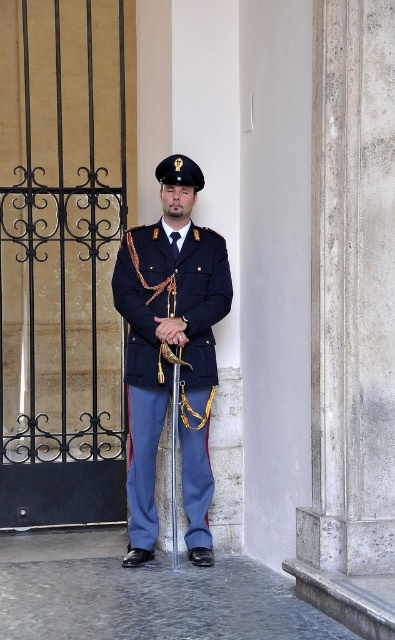
You are a tailor measuring a mannequin wearing the navy blue fabric uniform at center and the metallic gold pole at center. Which object has a greater width?

The navy blue fabric uniform at center has a greater width than the metallic gold pole at center.

You are a photographer planning to take a portrait of the navy blue fabric uniform at center. You want to ensure the black wrought iron gate at left is visible in the background but not too prominent. Given their sizes, can you position yourself so that the gate is partially visible without overwhelming the uniform?

The black wrought iron gate at left is wider than the navy blue fabric uniform at center. To include the gate in the background without it being too prominent, position yourself so that only a portion of the gate is visible, as its greater width might otherwise dominate the frame.

You are a photographer trying to capture the ceremonial sword and the ornate black wrought iron gates in the background. You notice two points on the image at coordinates point (142, 440) and point (174, 433). Which point is closer to the camera?

Point (142, 440) is further to the camera than point (174, 433), so point (174, 433) is closer to the camera.